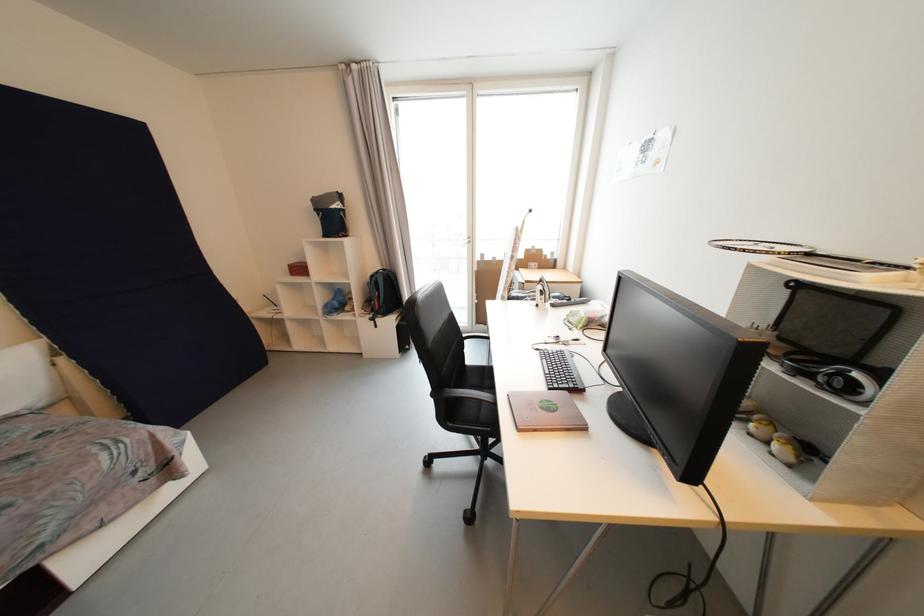
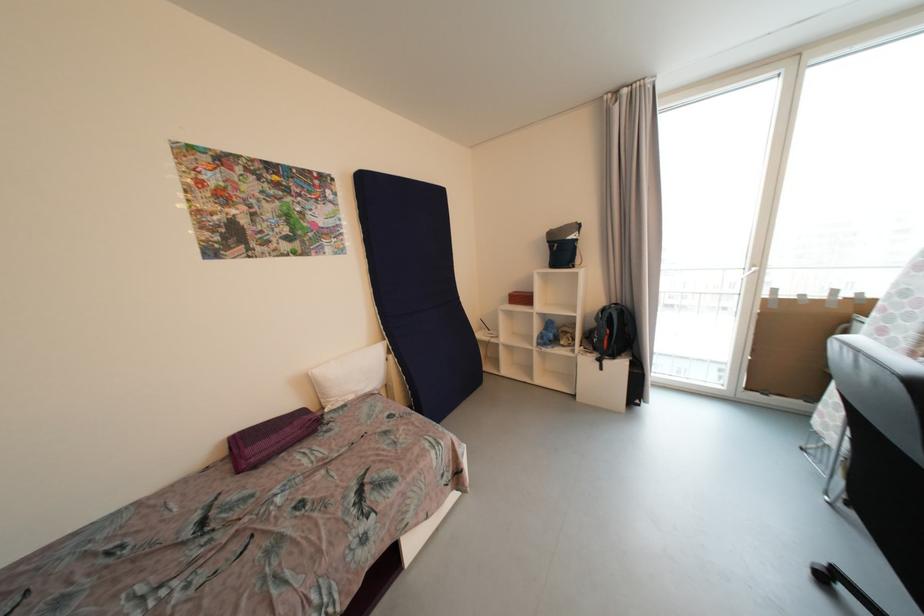
Find the pixel in the second image that matches point (378, 278) in the first image.

(608, 312)